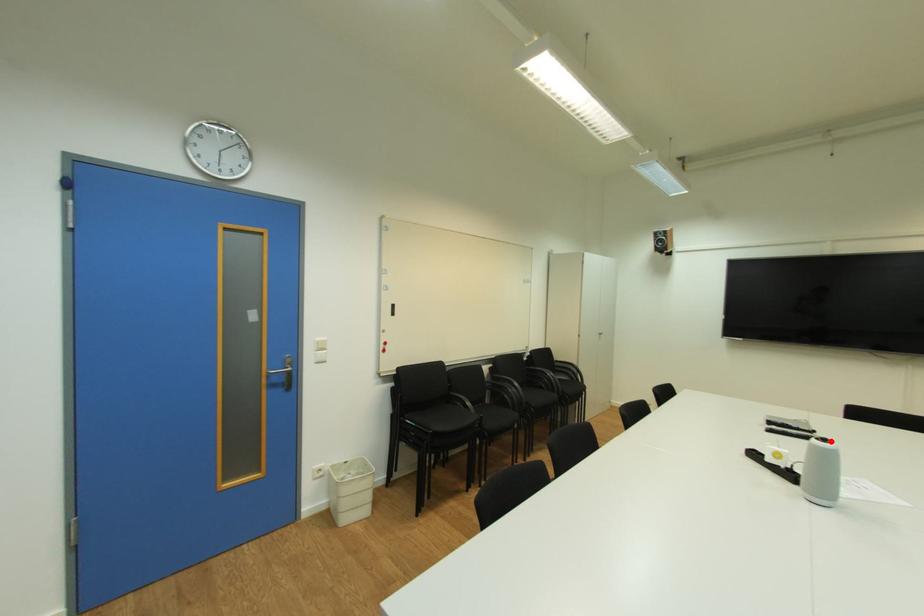
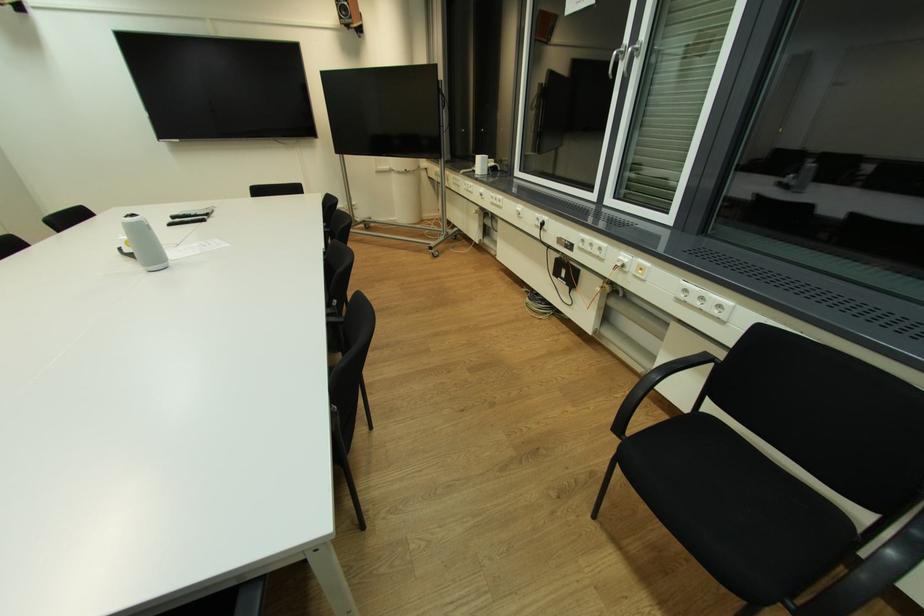
Question: A red point is marked in image1. In image2, is the corresponding 3D point closer to the camera or farther? Reply with the corresponding letter.

Choices:
 (A) The corresponding 3D point is closer.
 (B) The corresponding 3D point is farther.

Answer: (B)